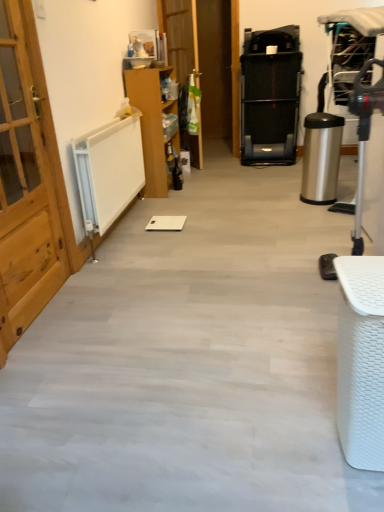
Question: From a real-world perspective, is white woven basket at lower right, which is counted as the second furniture, starting from the left, beneath light wood door at left, the second door when ordered from top to bottom?

Choices:
 (A) no
 (B) yes

Answer: (B)

Question: Could you tell me if white woven basket at lower right, which is counted as the second furniture, starting from the left, is turned towards light wood door at left, the second door viewed from the right?

Choices:
 (A) yes
 (B) no

Answer: (B)

Question: Considering the relative sizes of white woven basket at lower right, the first furniture when ordered from bottom to top, and light wood door at left, marked as the first door in a left-to-right arrangement, in the image provided, is white woven basket at lower right, the first furniture when ordered from bottom to top, bigger than light wood door at left, marked as the first door in a left-to-right arrangement,?

Choices:
 (A) yes
 (B) no

Answer: (B)

Question: Does white woven basket at lower right, the 2th furniture in the top-to-bottom sequence, come in front of light wood door at left, which is the first door in front-to-back order?

Choices:
 (A) no
 (B) yes

Answer: (B)

Question: Is white woven basket at lower right, the 2th furniture in the top-to-bottom sequence, turned away from light wood door at left, the second door viewed from the right?

Choices:
 (A) no
 (B) yes

Answer: (A)

Question: Can you confirm if white woven basket at lower right, the first furniture when ordered from bottom to top, is thinner than light wood door at left, marked as the first door in a left-to-right arrangement?

Choices:
 (A) no
 (B) yes

Answer: (A)

Question: Can you confirm if light wood door at left, the second door viewed from the right, is bigger than wooden cabinet at center, arranged as the second furniture when viewed from the right?

Choices:
 (A) no
 (B) yes

Answer: (A)

Question: Is light wood door at left, the second door viewed from the right, positioned far away from wooden cabinet at center, the 2th furniture positioned from the front?

Choices:
 (A) yes
 (B) no

Answer: (A)

Question: Can you confirm if light wood door at left, the second door when ordered from top to bottom, is thinner than wooden cabinet at center, which is the first furniture from back to front?

Choices:
 (A) no
 (B) yes

Answer: (B)

Question: Does light wood door at left, marked as the first door in a left-to-right arrangement, turn towards wooden cabinet at center, which is the first furniture from back to front?

Choices:
 (A) no
 (B) yes

Answer: (A)

Question: Does light wood door at left, the 2th door in the back-to-front sequence, lie behind wooden cabinet at center, which is the first furniture from back to front?

Choices:
 (A) no
 (B) yes

Answer: (A)

Question: Is light wood door at left, the second door when ordered from top to bottom, outside wooden cabinet at center, arranged as the second furniture when viewed from the right?

Choices:
 (A) yes
 (B) no

Answer: (A)

Question: Is wooden cabinet at center, which is the first furniture from back to front, positioned far away from light wood door at left, which is the first door in front-to-back order?

Choices:
 (A) yes
 (B) no

Answer: (A)